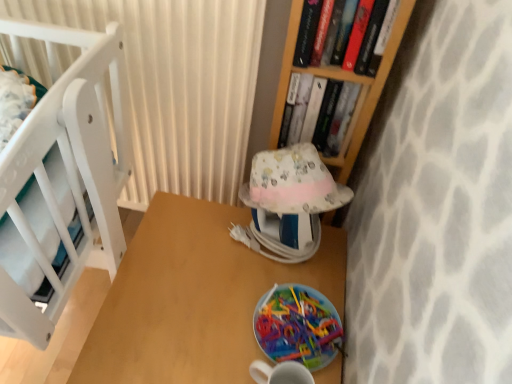
You are a GUI agent. You are given a task and a screenshot of the screen. Output one action in this format:
    pyautogui.click(x=<x>, y=<y>)
    Task: Click on the free space in front of patterned fabric lampshade at center
    This screenshot has height=384, width=512.
    Given the screenshot: What is the action you would take?
    pyautogui.click(x=239, y=298)